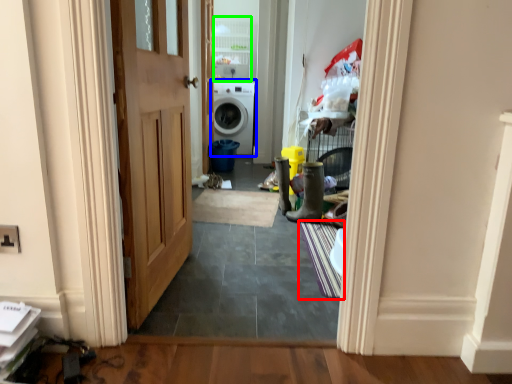
Question: Which object is positioned closest to doormat (highlighted by a red box)? Select from washing machine (highlighted by a blue box) and cabinetry (highlighted by a green box).

Choices:
 (A) washing machine
 (B) cabinetry

Answer: (A)